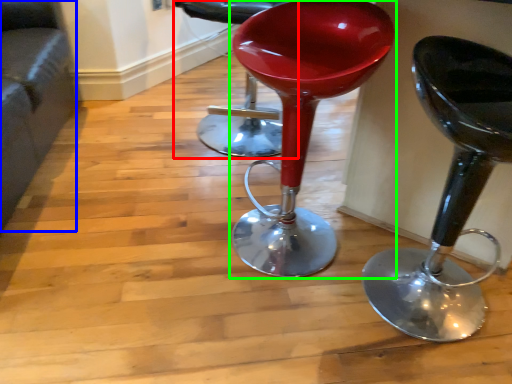
Question: Based on their relative distances, which object is farther from chair (highlighted by a red box)? Choose from couch (highlighted by a blue box) and stool (highlighted by a green box).

Choices:
 (A) couch
 (B) stool

Answer: (A)